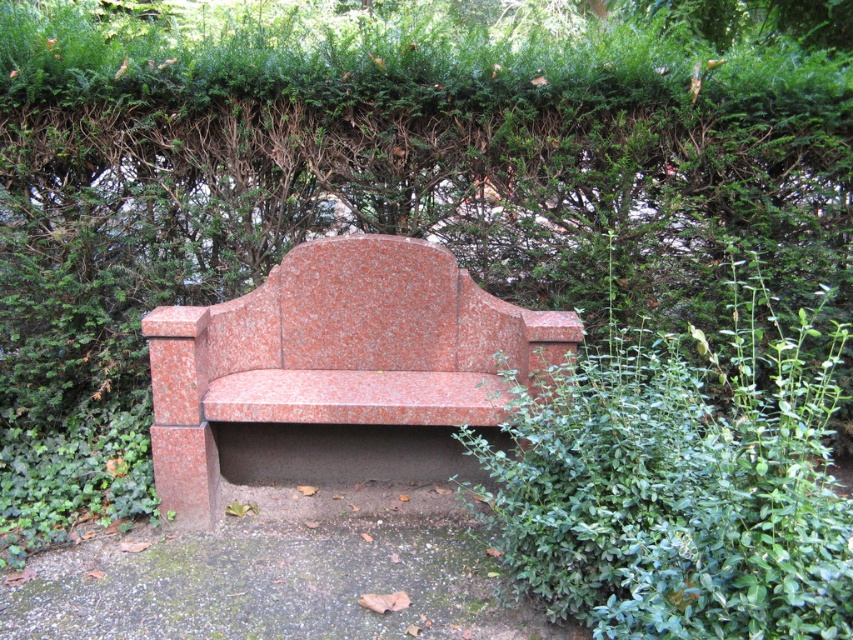
Question: Is green leafy bush at lower right closer to camera compared to granite bench at center?

Choices:
 (A) yes
 (B) no

Answer: (A)

Question: Does green leafy bush at lower right have a lesser width compared to granite bench at center?

Choices:
 (A) yes
 (B) no

Answer: (A)

Question: Which object appears closest to the camera in this image?

Choices:
 (A) granite bench at center
 (B) green leafy bush at lower right

Answer: (B)

Question: Does green leafy bush at lower right appear on the left side of granite bench at center?

Choices:
 (A) yes
 (B) no

Answer: (B)

Question: Which point is closer to the camera taking this photo?

Choices:
 (A) (517, 486)
 (B) (451, 410)

Answer: (A)